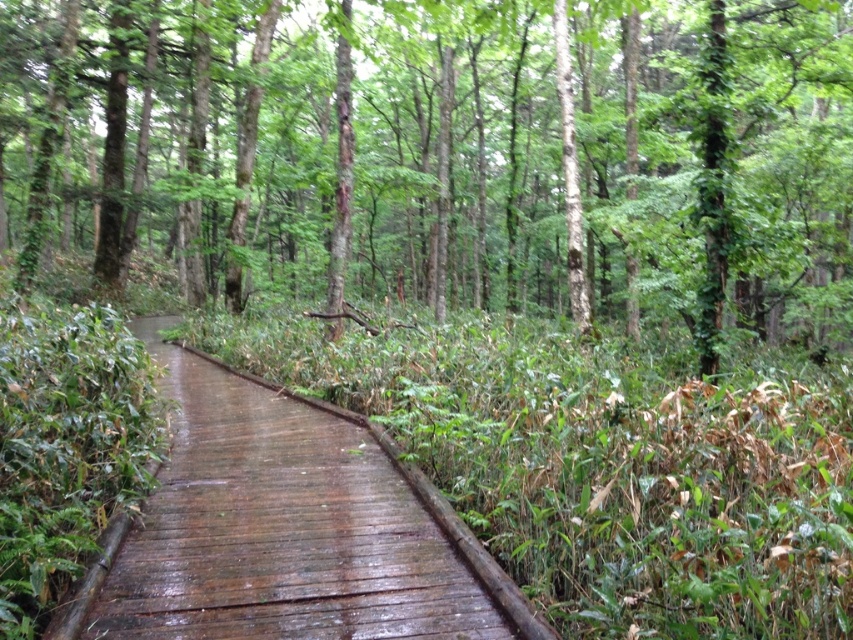
You are standing at the camera position looking at the forest boardwalk. There is a point at coordinates point (412, 170). Can you estimate how far you are from that point?

The distance between you and the point (412, 170) is 101.22 feet.

Based on the scene description, where is the green matte tree at center located in terms of its 2D coordinates?

The green matte tree at center is located at the 2D coordinates of point (x=453, y=154).